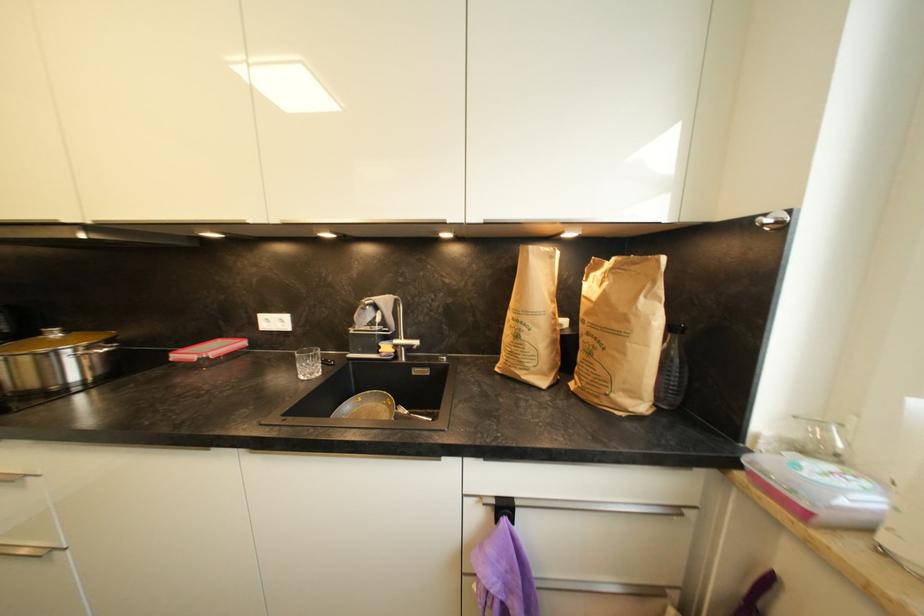
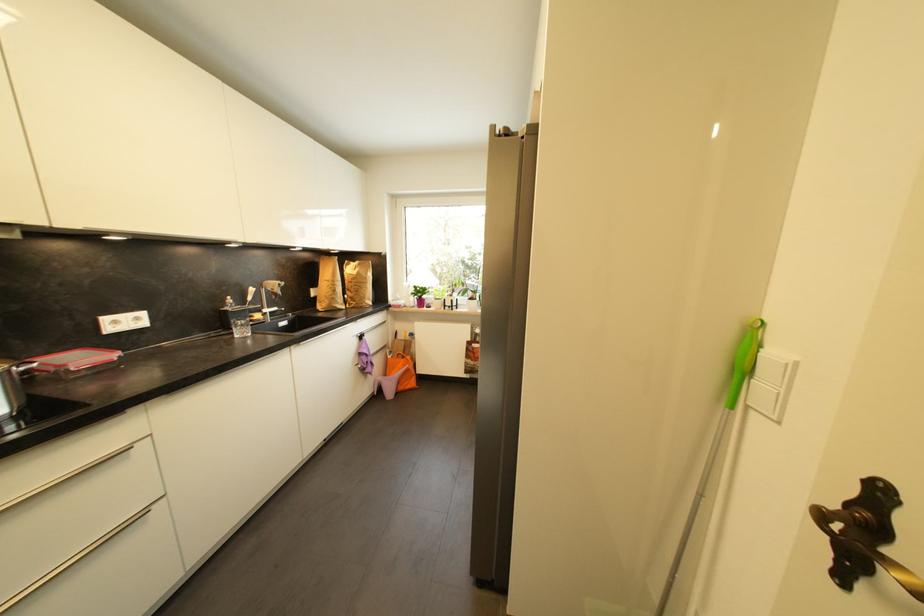
Find the pixel in the second image that matches [286,323] in the first image.

(142, 321)